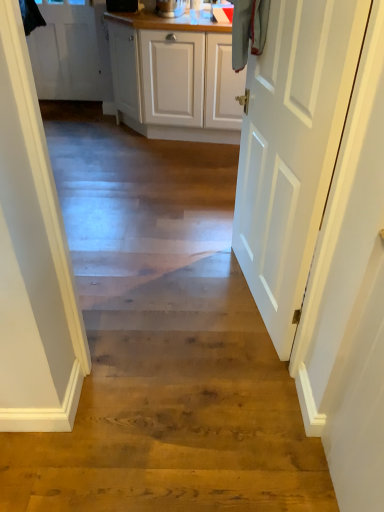
Question: Visually, is white matte door at right, the 1th door viewed from the front, positioned to the left or to the right of white matte door at upper left, which is counted as the 1th door, starting from the left?

Choices:
 (A) left
 (B) right

Answer: (B)

Question: Is white matte door at right, the 1th door viewed from the front, wider or thinner than white matte door at upper left, which is the second door in bottom-to-top order?

Choices:
 (A) wide
 (B) thin

Answer: (A)

Question: Is point (246, 180) positioned closer to the camera than point (99, 97)?

Choices:
 (A) farther
 (B) closer

Answer: (B)

Question: Is white matte door at upper left, which ranks as the first door in top-to-bottom order, wider or thinner than white matte door at right, which appears as the second door when viewed from the top?

Choices:
 (A) thin
 (B) wide

Answer: (A)

Question: Is white matte door at upper left, which is counted as the 2th door, starting from the right, in front of or behind white matte door at right, which is the 1th door in right-to-left order, in the image?

Choices:
 (A) front
 (B) behind

Answer: (B)

Question: Would you say white matte door at upper left, which ranks as the first door in top-to-bottom order, is inside or outside white matte door at right, the 1th door viewed from the front?

Choices:
 (A) outside
 (B) inside

Answer: (A)

Question: From the image's perspective, is white matte door at upper left, which is the second door in bottom-to-top order, positioned above or below white matte door at right, which is the 1th door in right-to-left order?

Choices:
 (A) above
 (B) below

Answer: (A)